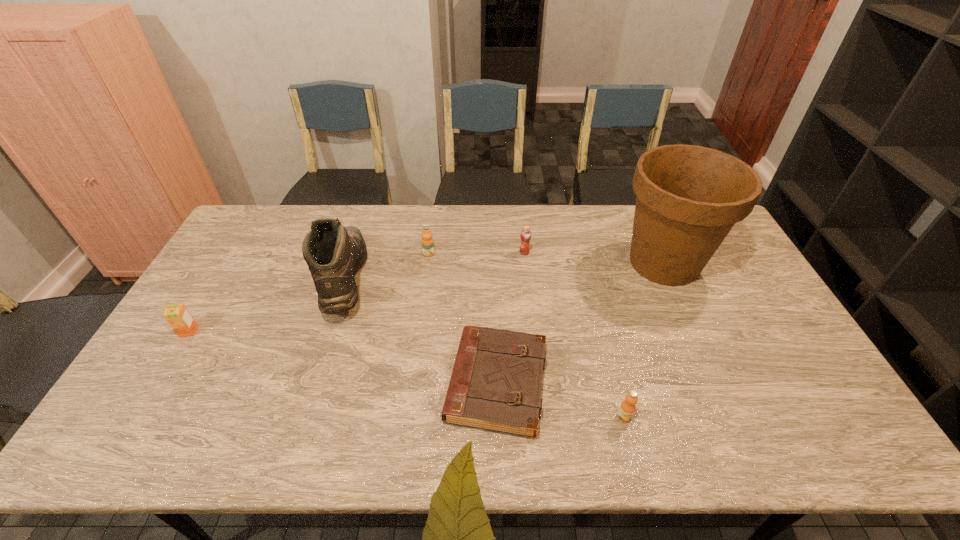
Where is `orange juice that is at the near edge`? The width and height of the screenshot is (960, 540). orange juice that is at the near edge is located at coordinates (626, 411).

At what (x,y) coordinates should I click in order to perform the action: click on hardback book that is at the near edge. Please return your answer as a coordinate pair (x, y). Looking at the image, I should click on (495, 385).

The width and height of the screenshot is (960, 540). I want to click on object located in the left edge section of the desktop, so click(178, 316).

Locate an element on the screen. The image size is (960, 540). object located at the right edge is located at coordinates (689, 197).

Image resolution: width=960 pixels, height=540 pixels. I want to click on object that is positioned at the far right corner, so click(689, 197).

Where is `free space at the far edge`? free space at the far edge is located at coordinates (403, 222).

This screenshot has height=540, width=960. In the image, there is a desktop. What are the coordinates of `free space at the near edge` in the screenshot? It's located at (441, 441).

In order to click on vacant space at the left edge of the desktop in this screenshot , I will do `click(232, 260)`.

Where is `vacant area at the right edge`? vacant area at the right edge is located at coordinates (761, 308).

Identify the location of free space that is in between the hardback book and the second orange juice from left to right. The image size is (960, 540). (463, 319).